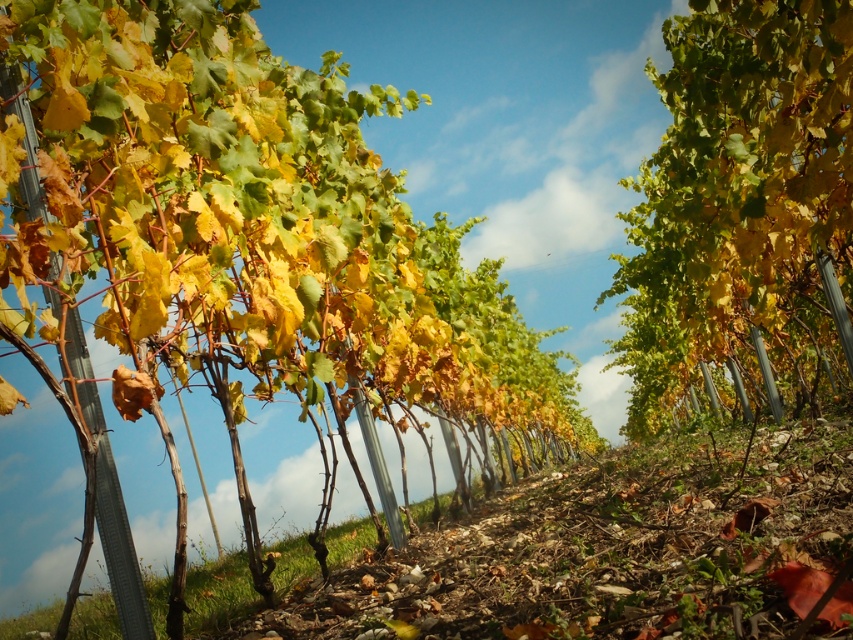
Question: Can you confirm if green leafy vine at center is positioned below yellow-green foliage at center?

Choices:
 (A) yes
 (B) no

Answer: (A)

Question: Which point appears farthest from the camera in this image?

Choices:
 (A) (769, 288)
 (B) (97, 134)

Answer: (A)

Question: Is green leafy vine at center above yellow-green foliage at center?

Choices:
 (A) yes
 (B) no

Answer: (B)

Question: Where is green leafy vine at center located in relation to yellow-green foliage at center in the image?

Choices:
 (A) above
 (B) below

Answer: (B)